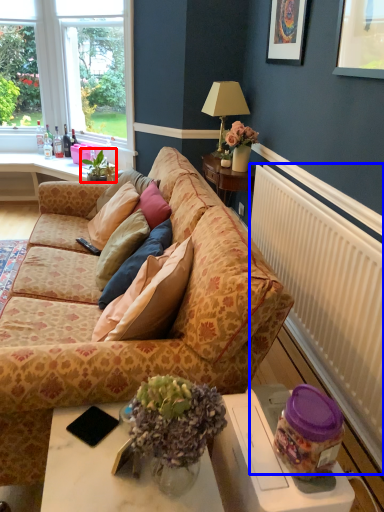
Question: Among these objects, which one is nearest to the camera, houseplant (highlighted by a red box) or radiator (highlighted by a blue box)?

Choices:
 (A) houseplant
 (B) radiator

Answer: (B)